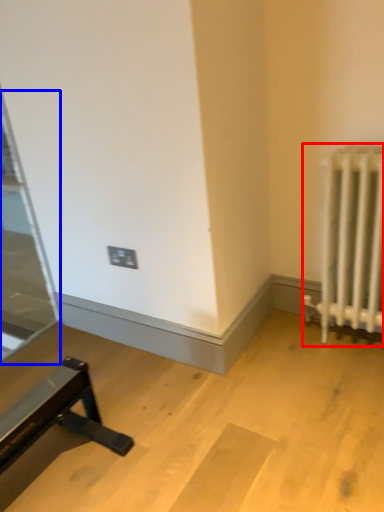
Question: Which of the following is the closest to the observer, radiator (highlighted by a red box) or glass door (highlighted by a blue box)?

Choices:
 (A) radiator
 (B) glass door

Answer: (A)